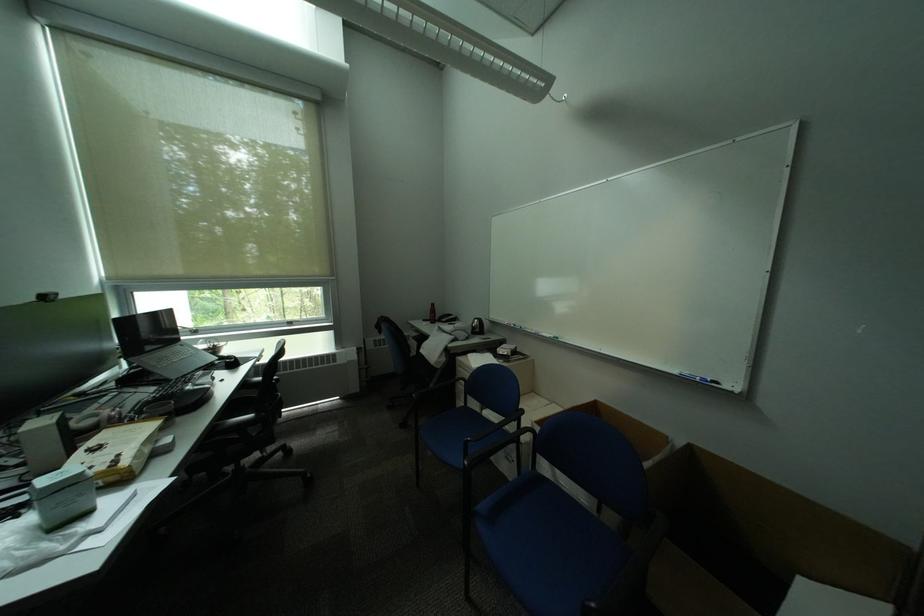
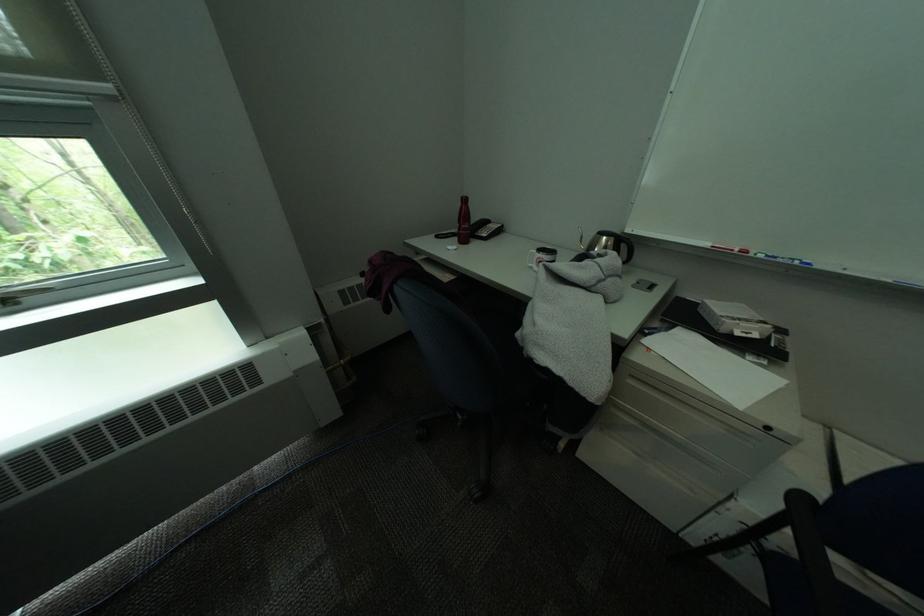
The point at [345,280] is marked in the first image. Where is the corresponding point in the second image?

(119, 87)